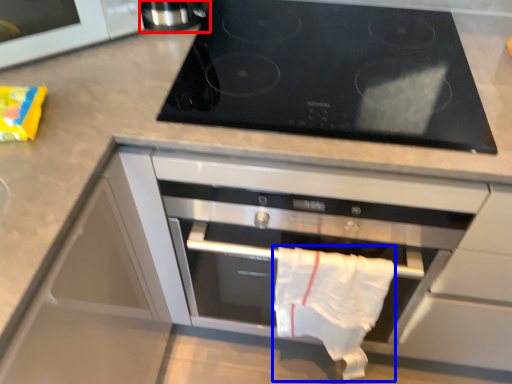
Question: Which of the following is the closest to the observer, appliance (highlighted by a red box) or cloth (highlighted by a blue box)?

Choices:
 (A) appliance
 (B) cloth

Answer: (B)